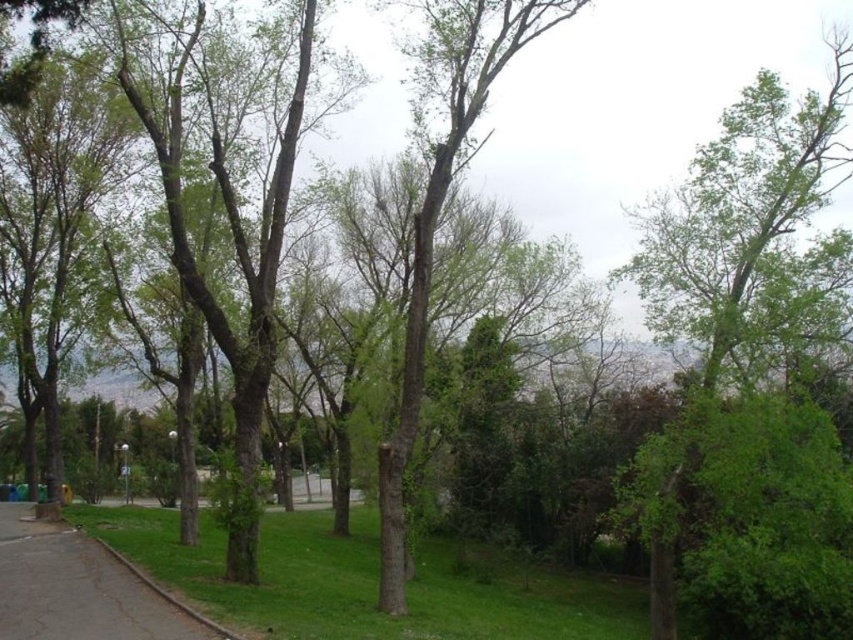
You are a gardener planning to plant a new tree in the park. The green leafy tree at center and the concrete sidewalk at lower left are both in the area you are considering. Based on their sizes, which one might require more space for proper growth?

The green leafy tree at center requires more space for proper growth since it is larger in size than the concrete sidewalk at lower left.

You are standing on the concrete sidewalk at lower left and want to walk towards the green leafy tree at center. Which direction should you move to get closer to the tree?

You should move forward because the green leafy tree at center is further to the viewer than the concrete sidewalk at lower left, meaning it is closer to you and you are already on the sidewalk which is at a lower position. Wait, but the description says the tree is further to the viewer than the sidewalk. Hmm, maybe I need to rephrase. Since the tree is further away from the viewer, you need to move forward along the path towards it.